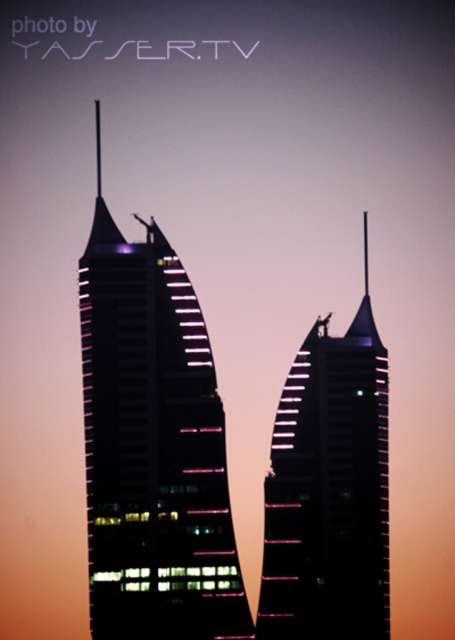
Question: Which point is farther to the camera?

Choices:
 (A) (338, 419)
 (B) (185, 636)

Answer: (B)

Question: Which of the following is the farthest from the observer?

Choices:
 (A) (384, 416)
 (B) (171, 333)

Answer: (A)

Question: Does matte glass skyscraper at center appear under black glass skyscraper at center?

Choices:
 (A) yes
 (B) no

Answer: (B)

Question: Is the position of matte glass skyscraper at center more distant than that of black glass skyscraper at center?

Choices:
 (A) no
 (B) yes

Answer: (A)

Question: Which object is closer to the camera taking this photo?

Choices:
 (A) black glass skyscraper at center
 (B) matte glass skyscraper at center

Answer: (B)

Question: Is matte glass skyscraper at center bigger than black glass skyscraper at center?

Choices:
 (A) no
 (B) yes

Answer: (B)